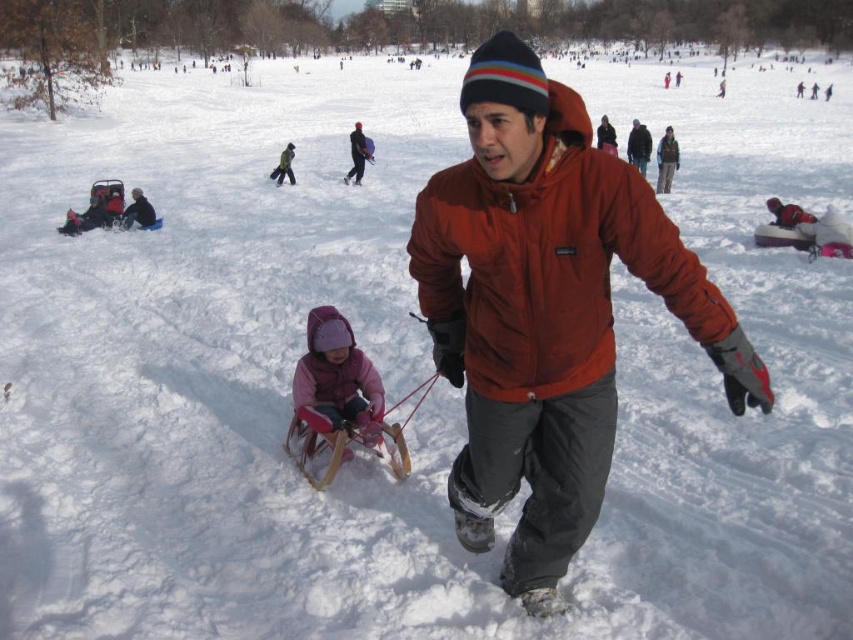
Consider the image. You are a photographer trying to capture both the dark brown leather jacket at upper center and the dark blue snowsuit at left in a single shot. Given their sizes, which one might appear larger in the photo?

The dark brown leather jacket at upper center will appear larger in the photo since it is bigger than the dark blue snowsuit at left.

You are standing at the point marked by the coordinates point (357, 154) in the snowy park scene. Looking around, you see a man in a red jacket and a child on a sled. Which direction should you walk to reach the man in the red jacket?

The point (357, 154) is on the matte black jacket at center. The man in the red jacket is in the foreground, so you should walk forward towards him.

You are standing at the edge of the snowy park and see the dark brown leather jacket at upper center. If you want to reach it quickly, should you walk straight ahead or turn left? Please explain your reasoning based on the jacket location and the scene description.

The dark brown leather jacket at upper center is 21.70 meters from the viewer. Since it is located at the upper center of the image, walking straight ahead would be the most direct path to reach it quickly.